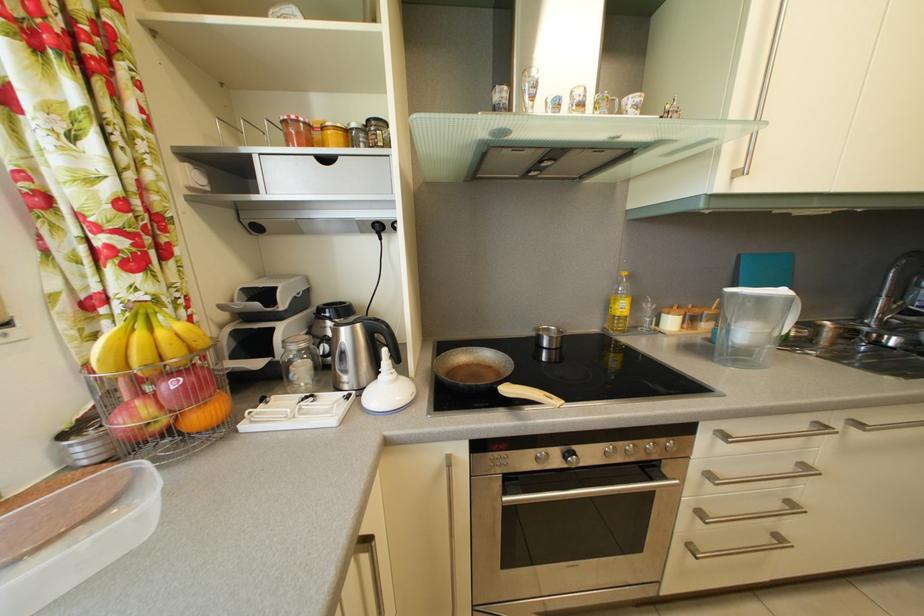
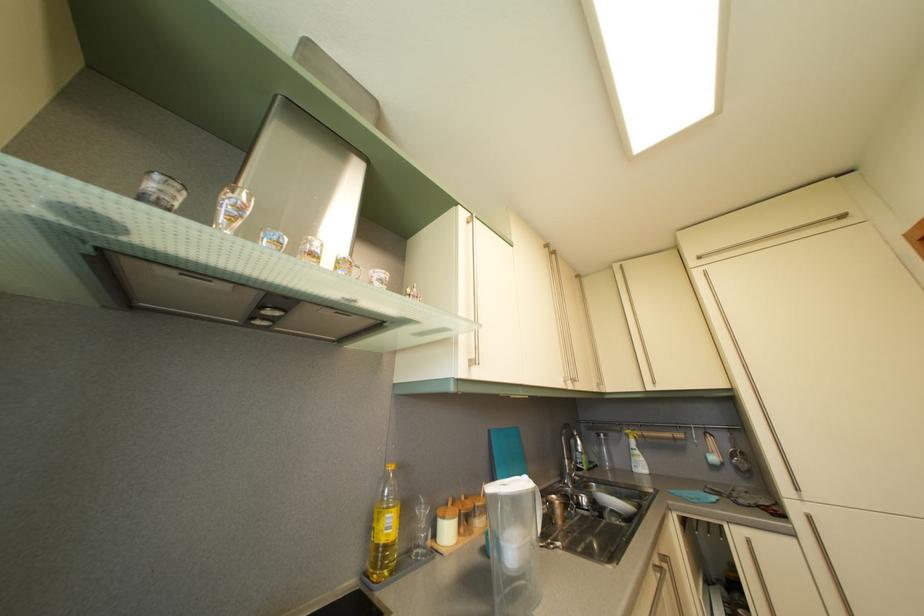
How did the camera likely rotate?

The camera rotated toward right-up.